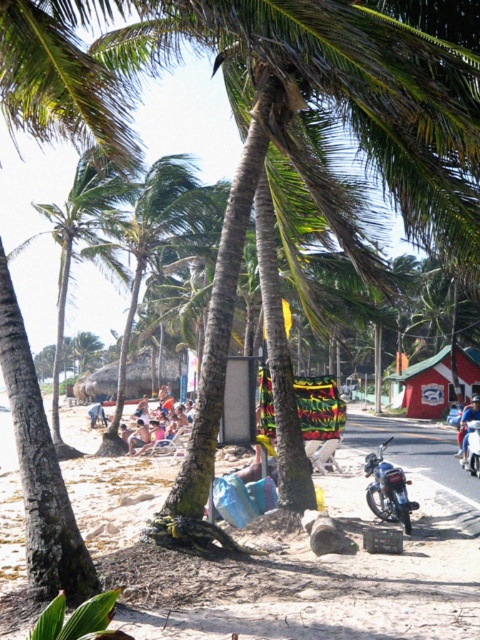
You are standing at the beach and want to walk from the point labeled point (373, 497) to the point labeled point (464, 429). According to the scene description, which direction should you head to reach your destination?

You should head backward because point (373, 497) is in front of point (464, 429), so moving away from the direction you are facing will lead you towards the second point.

You are standing at the origin point of the coordinate system in this beach scene. You want to walk to the beach sand at lower left. Which direction should you move in to reach it?

Since the beach sand at lower left is located at coordinate point (291, 556), you should move towards the lower left direction from your current position at the origin to reach it.

You are standing at the beach sand at lower left represented by point [291,556] and want to walk towards the motorcycle parked to the right. Is the motorcycle located to your left or right side?

The motorcycle is located to your right side because the beach sand at lower left is represented by point [291,556], and the motorcycle is parked to the right side of the image.